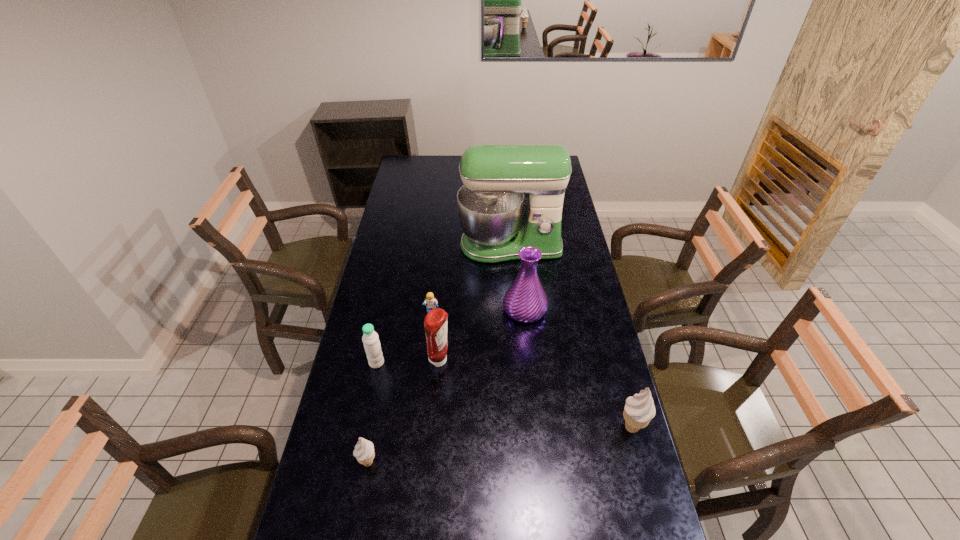
Identify the location of free space located on the front-facing side of the left icecream. This screenshot has height=540, width=960. (326, 463).

The width and height of the screenshot is (960, 540). Find the location of `vacant space located 0.110m on the front-facing side of the left icecream`. vacant space located 0.110m on the front-facing side of the left icecream is located at coordinates (320, 463).

This screenshot has height=540, width=960. I want to click on vacant region located on the front-facing side of the left icecream, so click(x=330, y=463).

You are a GUI agent. You are given a task and a screenshot of the screen. Output one action in this format:
    pyautogui.click(x=<x>, y=<y>)
    Task: Click on the vacant space located on the front-facing side of the sixth farthest object
    Image resolution: width=960 pixels, height=540 pixels.
    Given the screenshot: What is the action you would take?
    pyautogui.click(x=501, y=428)

Where is `vacant space situated 0.280m on the front-facing side of the sixth farthest object`? vacant space situated 0.280m on the front-facing side of the sixth farthest object is located at coordinates tap(525, 428).

At what (x,y) coordinates should I click in order to perform the action: click on free space located 0.230m on the front-facing side of the sixth farthest object. Please return your answer as a coordinate pair (x, y). This screenshot has height=540, width=960. Looking at the image, I should click on (541, 428).

Locate an element on the screen. The width and height of the screenshot is (960, 540). free point located on the back of the vase is located at coordinates (517, 238).

Find the location of a particular element. Image resolution: width=960 pixels, height=540 pixels. vacant space located on the controls of the tallest object is located at coordinates (517, 338).

At what (x,y) coordinates should I click in order to perform the action: click on free spot located on the front-facing side of the Lego. Please return your answer as a coordinate pair (x, y). Image resolution: width=960 pixels, height=540 pixels. Looking at the image, I should click on (424, 382).

You are a GUI agent. You are given a task and a screenshot of the screen. Output one action in this format:
    pyautogui.click(x=<x>, y=<y>)
    Task: Click on the vacant space located 0.080m on the right of the condiment
    
    Given the screenshot: What is the action you would take?
    pyautogui.click(x=474, y=361)